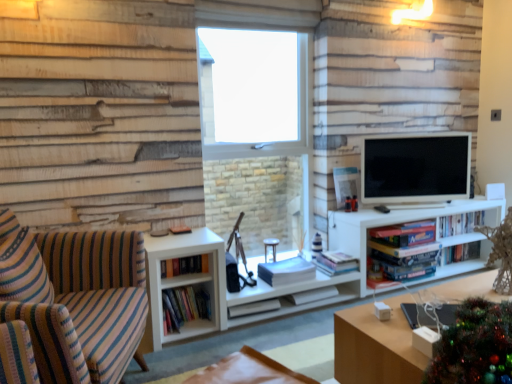
Question: Considering the positions of wooden table at lower right and white matte entertainment center at center in the image, is wooden table at lower right wider or thinner than white matte entertainment center at center?

Choices:
 (A) thin
 (B) wide

Answer: (B)

Question: Relative to white matte entertainment center at center, is wooden table at lower right in front or behind?

Choices:
 (A) behind
 (B) front

Answer: (B)

Question: Considering the real-world distances, which object is farthest from the hardcover books at center left, the second book positioned from the left?

Choices:
 (A) wooden table at lower right
 (B) hardcover books at right, marked as the second book in a right-to-left arrangement
 (C) white matte entertainment center at center
 (D) striped fabric couch at left
 (E) hardcover books at center, which appears as the 3th book when viewed from the right

Answer: (B)

Question: Which object is positioned closest to the matte black tv at right?

Choices:
 (A) hardcover books at center left, the second book positioned from the left
 (B) hardcover books at center, which appears as the 1th book when viewed from the left
 (C) hardcover books at right, which ranks as the 8th book in left-to-right order
 (D) white matte book at center, the seventh book in the right-to-left sequence
 (E) striped fabric couch at left

Answer: (C)